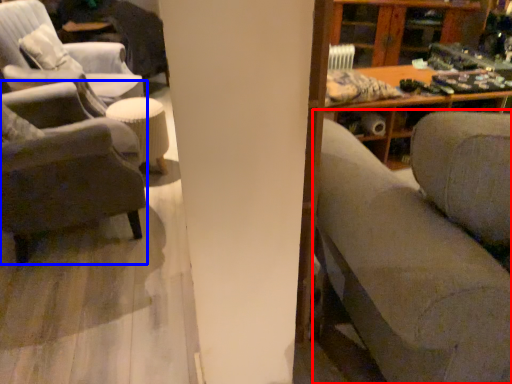
Question: Which of the following is the closest to the observer, studio couch (highlighted by a red box) or chair (highlighted by a blue box)?

Choices:
 (A) studio couch
 (B) chair

Answer: (A)